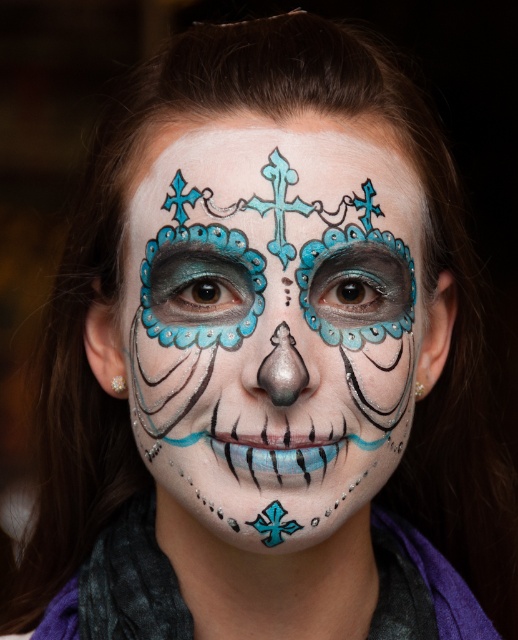
Between matte blue face paint at center and blue glossy cross at lower center, which one appears on the left side from the viewer's perspective?

From the viewer's perspective, blue glossy cross at lower center appears more on the left side.

How much distance is there between matte blue face paint at center and blue glossy cross at lower center?

matte blue face paint at center and blue glossy cross at lower center are 4.90 inches apart from each other.

Describe the element at coordinates (272, 323) in the screenshot. I see `matte blue face paint at center` at that location.

Where is `matte blue face paint at center`? The height and width of the screenshot is (640, 518). matte blue face paint at center is located at coordinates (272, 323).